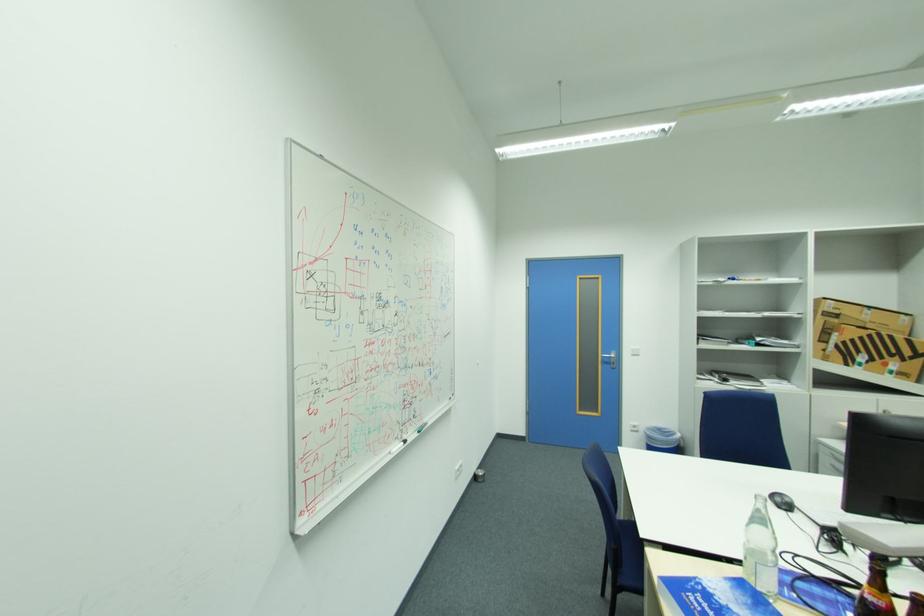
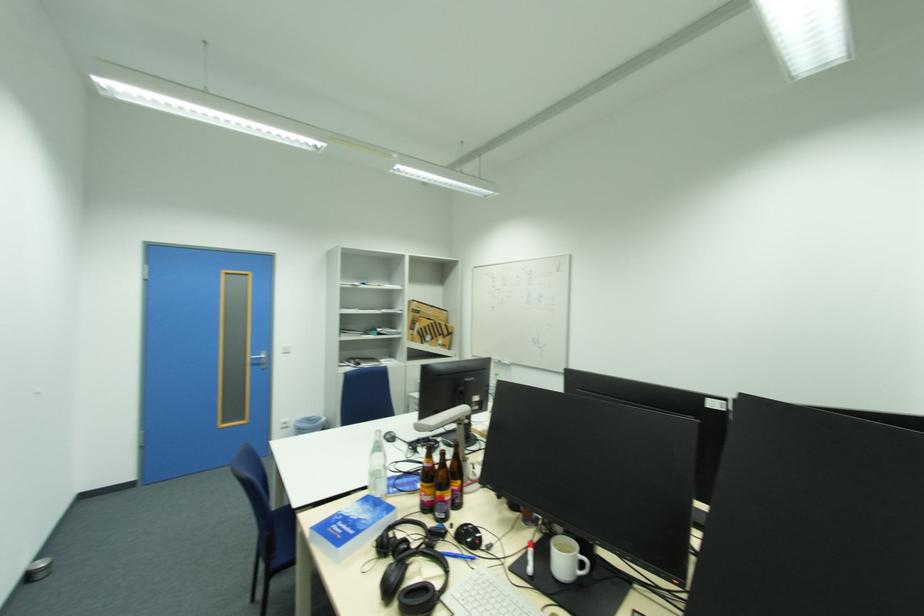
Locate, in the second image, the point that corresponds to [760,556] in the first image.

(380, 476)